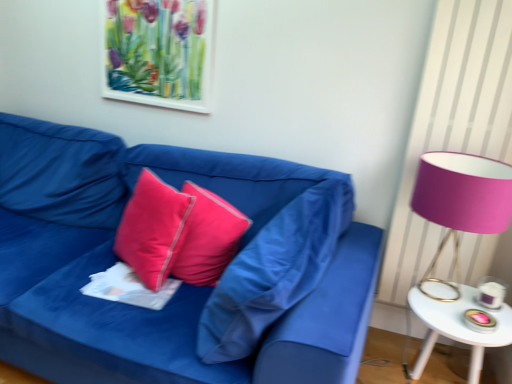
Question: Is white paper at center wider or thinner than pink fabric lampshade at right?

Choices:
 (A) thin
 (B) wide

Answer: (A)

Question: From the image's perspective, is white paper at center located above or below pink fabric lampshade at right?

Choices:
 (A) above
 (B) below

Answer: (B)

Question: Considering the real-world distances, which object is farthest from the pink fabric lampshade at right?

Choices:
 (A) white glossy side table at right
 (B) satin pink pillow at center, the 3th pillow when ordered from right to left
 (C) silky pink pillow at center, placed as the 2th pillow when sorted from left to right
 (D) matte pink pillow at center, which appears as the 1th pillow when viewed from the right
 (E) matte blue fabric couch at center

Answer: (B)

Question: Based on their relative distances, which object is farther from the satin pink pillow at center, acting as the 1th pillow starting from the left?

Choices:
 (A) watercolor paper picture frame at upper center
 (B) matte pink pillow at center, the third pillow when ordered from left to right
 (C) pink fabric lampshade at right
 (D) white glossy side table at right
 (E) white paper at center

Answer: (D)